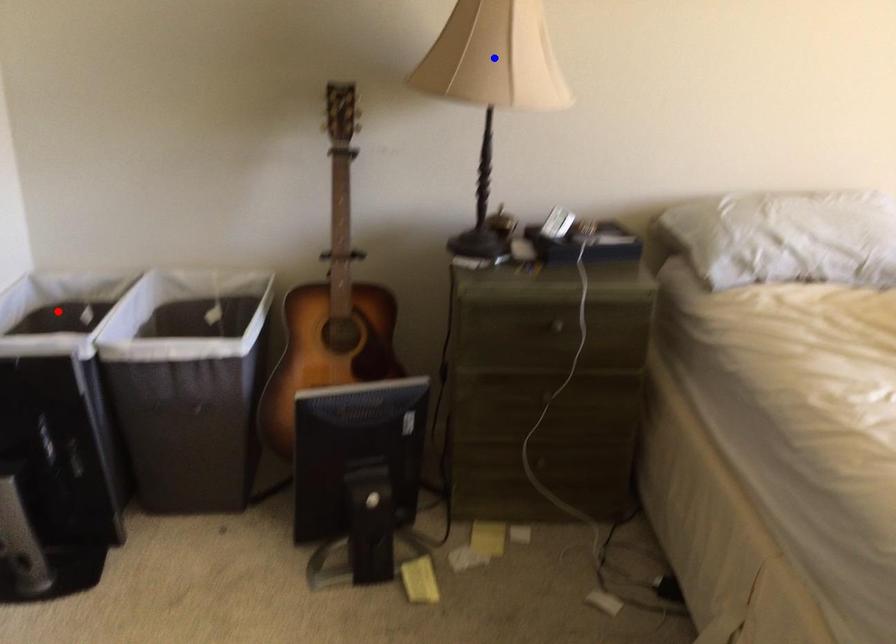
Question: In the image, two points are highlighted. Which point is nearer to the camera? Reply with the corresponding letter.

Choices:
 (A) blue point
 (B) red point

Answer: (A)